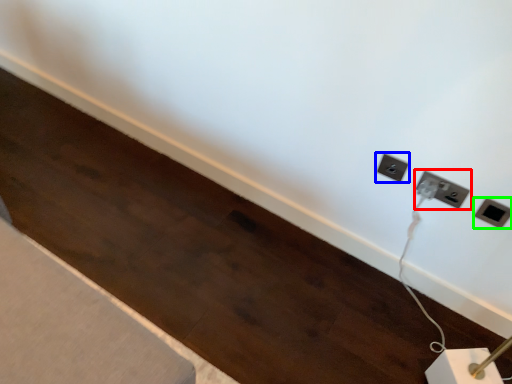
Question: Estimate the real-world distances between objects in this image. Which object is closer to power plugs and sockets (highlighted by a red box), power plugs and sockets (highlighted by a blue box) or power plugs and sockets (highlighted by a green box)?

Choices:
 (A) power plugs and sockets
 (B) power plugs and sockets

Answer: (B)